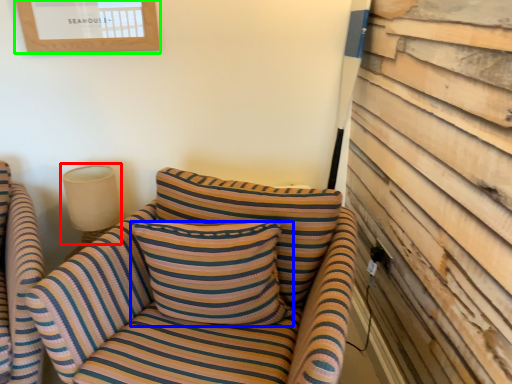
Question: Based on their relative distances, which object is nearer to lamp (highlighted by a red box)? Choose from pillow (highlighted by a blue box) and picture frame (highlighted by a green box).

Choices:
 (A) pillow
 (B) picture frame

Answer: (A)